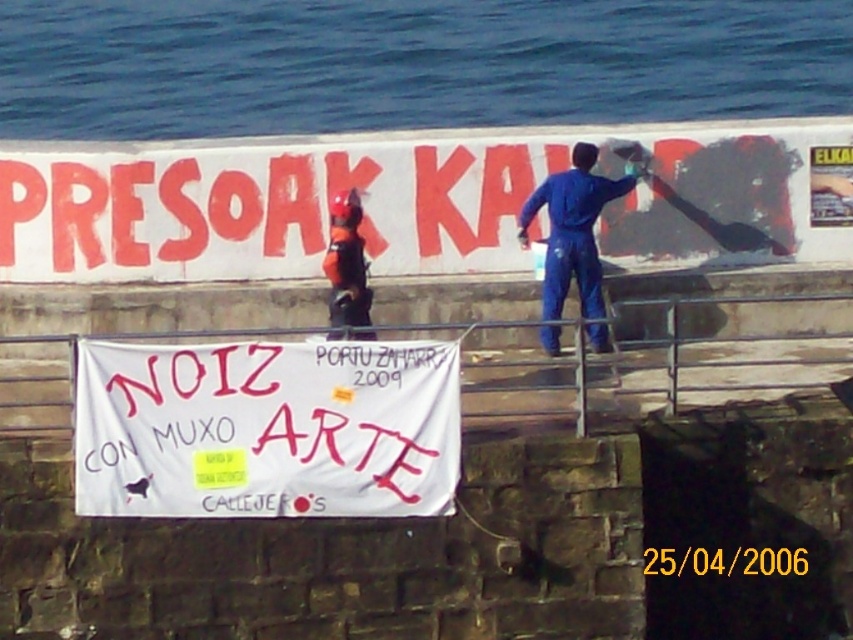
You are a painter who wants to hang a new sign that is 2 feet wide between the white paper banner at upper center and the brushed metal rail at center. Is there enough space to fit the sign without overlapping either object?

The distance between the white paper banner at upper center and the brushed metal rail at center is 7.04 feet. Since the sign is only 2 feet wide, there is sufficient space to place it between them without overlapping either object.

You are standing at the waterfront and looking at the blue water at upper left and the blue jumpsuit at upper center. Which object is closer to you?

The blue water at upper left is further to the viewer than the blue jumpsuit at upper center, so the blue jumpsuit at upper center is closer to you.